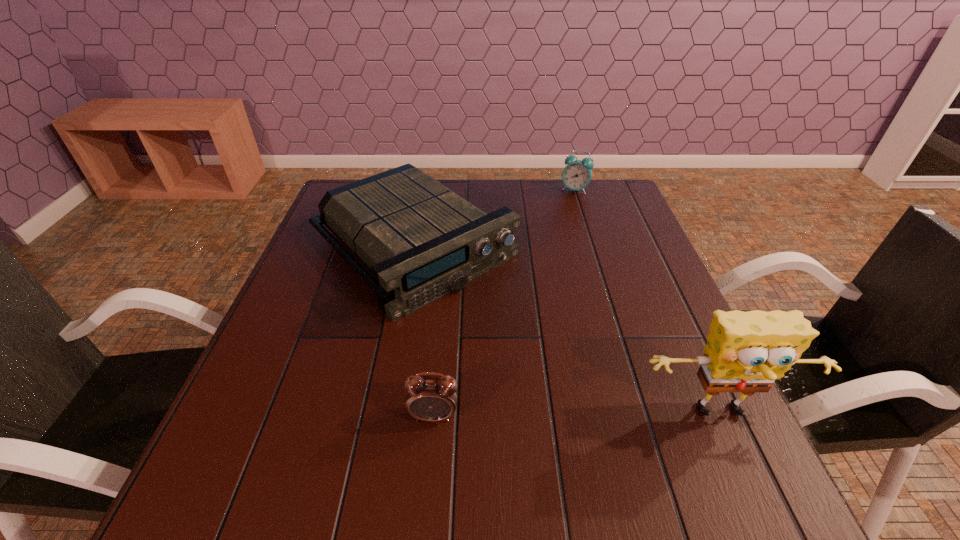
Where is `free location at the far edge`? This screenshot has width=960, height=540. free location at the far edge is located at coordinates (458, 189).

The image size is (960, 540). In the image, there is a desktop. In order to click on vacant space at the near edge in this screenshot , I will do `click(417, 437)`.

This screenshot has height=540, width=960. What are the coordinates of `blank space at the left edge` in the screenshot? It's located at (317, 244).

You are a GUI agent. You are given a task and a screenshot of the screen. Output one action in this format:
    pyautogui.click(x=<x>, y=<y>)
    Task: Click on the free space at the right edge of the desktop
    The width and height of the screenshot is (960, 540).
    Given the screenshot: What is the action you would take?
    pyautogui.click(x=632, y=314)

This screenshot has height=540, width=960. I want to click on free location at the near left corner of the desktop, so click(x=313, y=416).

This screenshot has width=960, height=540. I want to click on vacant region at the far right corner of the desktop, so click(624, 201).

Image resolution: width=960 pixels, height=540 pixels. In order to click on vacant area that lies between the right alarm clock and the sponge in this screenshot , I will do `click(648, 302)`.

At what (x,y) coordinates should I click in order to perform the action: click on free area in between the farther alarm clock and the sponge. Please return your answer as a coordinate pair (x, y). The width and height of the screenshot is (960, 540). Looking at the image, I should click on (648, 302).

This screenshot has width=960, height=540. What are the coordinates of `vacant space in between the sponge and the left alarm clock` in the screenshot? It's located at click(x=578, y=415).

The width and height of the screenshot is (960, 540). Identify the location of free space between the radio receiver and the nearer alarm clock. (423, 330).